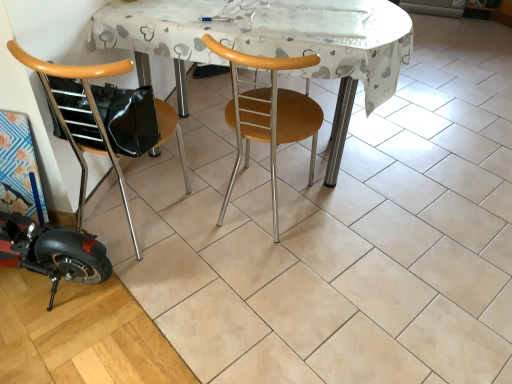
Question: Based on their sizes in the image, would you say woodenchair at left, positioned as the first chair in left-to-right order, is bigger or smaller than white plastic table at center?

Choices:
 (A) big
 (B) small

Answer: (B)

Question: Visually, is woodenchair at left, positioned as the first chair in left-to-right order, positioned to the left or to the right of white plastic table at center?

Choices:
 (A) left
 (B) right

Answer: (A)

Question: Based on their relative distances, which object is farther from the white plastic table at center?

Choices:
 (A) woodenwoodenchair at center, which ranks as the second chair in left-to-right order
 (B) woodenchair at left, positioned as the first chair in left-to-right order

Answer: (B)

Question: Which object is the closest to the woodenchair at left, positioned as the first chair in left-to-right order?

Choices:
 (A) white plastic table at center
 (B) woodenwoodenchair at center, which is the first chair from right to left

Answer: (B)